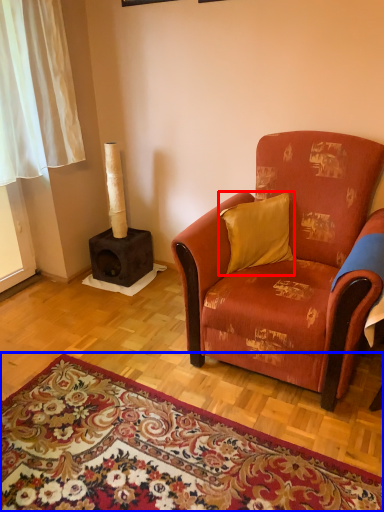
Question: Which of the following is the farthest to the observer, pillow (highlighted by a red box) or mat (highlighted by a blue box)?

Choices:
 (A) pillow
 (B) mat

Answer: (A)